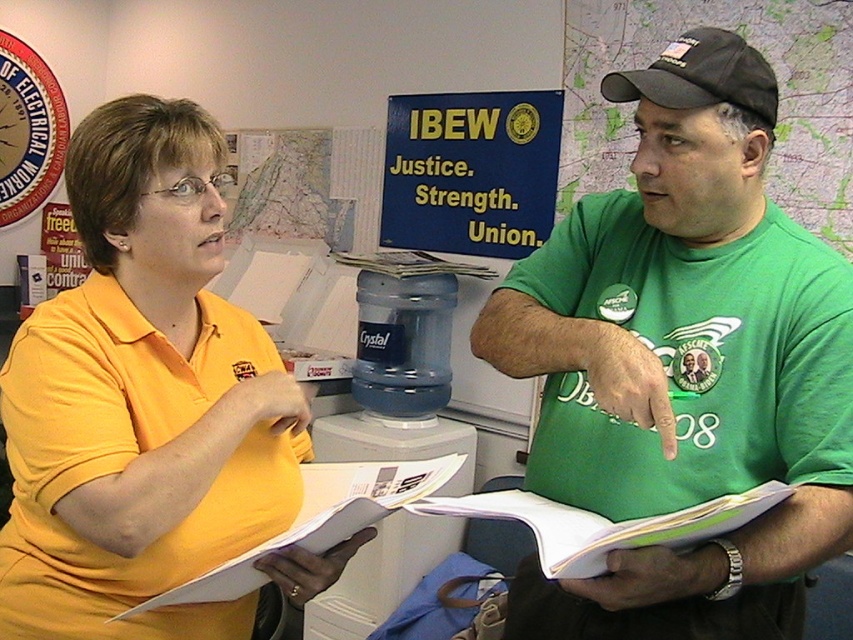
Question: Which object appears farthest from the camera in this image?

Choices:
 (A) white plastic water cooler at center
 (B) black fabric baseball cap at upper right

Answer: (A)

Question: Is black fabric cap at upper right wider than black fabric baseball cap at upper right?

Choices:
 (A) no
 (B) yes

Answer: (B)

Question: Which point is closer to the camera?

Choices:
 (A) white plastic water cooler at center
 (B) matte yellow shirt at center
 (C) black fabric cap at upper right
 (D) green cotton shirt at center

Answer: (D)

Question: Among these objects, which one is nearest to the camera?

Choices:
 (A) matte yellow shirt at center
 (B) white plastic water cooler at center
 (C) green cotton shirt at center
 (D) black fabric baseball cap at upper right

Answer: (C)

Question: Does black fabric cap at upper right lie in front of white plastic water cooler at center?

Choices:
 (A) no
 (B) yes

Answer: (B)

Question: Does matte yellow shirt at center appear under black fabric baseball cap at upper right?

Choices:
 (A) yes
 (B) no

Answer: (A)